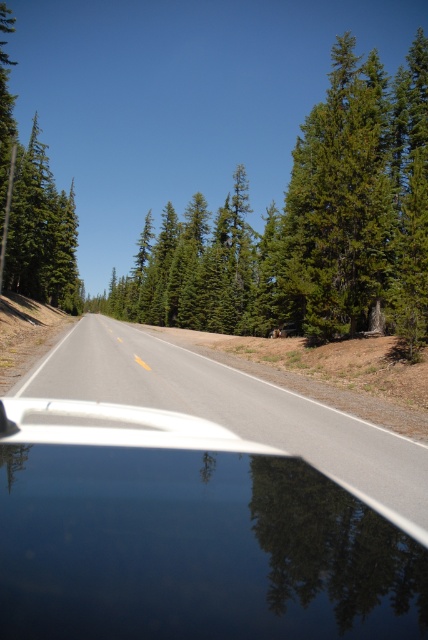
Question: Which of the following is the farthest from the observer?

Choices:
 (A) (5, 420)
 (B) (140, 342)

Answer: (B)

Question: Which of the following is the farthest from the observer?

Choices:
 (A) green matte tree at left
 (B) green textured tree at center
 (C) asphalt road at center

Answer: (A)

Question: Estimate the real-world distances between objects in this image. Which object is farther from the asphalt road at center?

Choices:
 (A) green textured tree at center
 (B) glossy black car at center
 (C) green matte tree at left

Answer: (A)

Question: Observing the image, what is the correct spatial positioning of glossy black car at center in reference to green matte tree at left?

Choices:
 (A) above
 (B) below

Answer: (B)

Question: Can you confirm if glossy black car at center is positioned above asphalt road at center?

Choices:
 (A) no
 (B) yes

Answer: (A)

Question: Does glossy black car at center have a greater width compared to green textured tree at center?

Choices:
 (A) yes
 (B) no

Answer: (B)